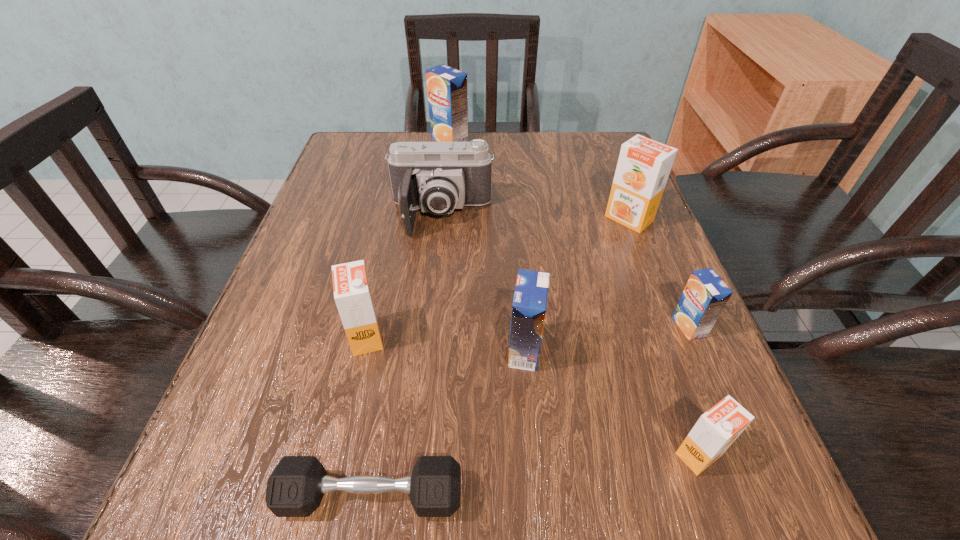
You are a GUI agent. You are given a task and a screenshot of the screen. Output one action in this format:
    pyautogui.click(x=<x>, y=<y>)
    Task: Click on the biggest blue orange_juice
    The width and height of the screenshot is (960, 540).
    Given the screenshot: What is the action you would take?
    pyautogui.click(x=447, y=87)

This screenshot has width=960, height=540. What are the coordinates of `the farthest orange_juice` in the screenshot? It's located at (447, 87).

Where is `the biggest orange orange juice`? the biggest orange orange juice is located at coordinates (644, 165).

I want to click on the farthest orange orange juice, so click(644, 165).

The width and height of the screenshot is (960, 540). I want to click on camera, so click(438, 177).

At what (x,y) coordinates should I click in order to perform the action: click on the leftmost orange_juice. Please return your answer as a coordinate pair (x, y). The width and height of the screenshot is (960, 540). Looking at the image, I should click on (352, 292).

Identify the location of the leftmost orange orange juice. (352, 292).

Where is `the fifth object from left to right`? This screenshot has width=960, height=540. the fifth object from left to right is located at coordinates (529, 305).

Locate an element on the screen. the second smallest blue orange_juice is located at coordinates (529, 305).

This screenshot has height=540, width=960. I want to click on the smallest orange orange juice, so click(715, 431).